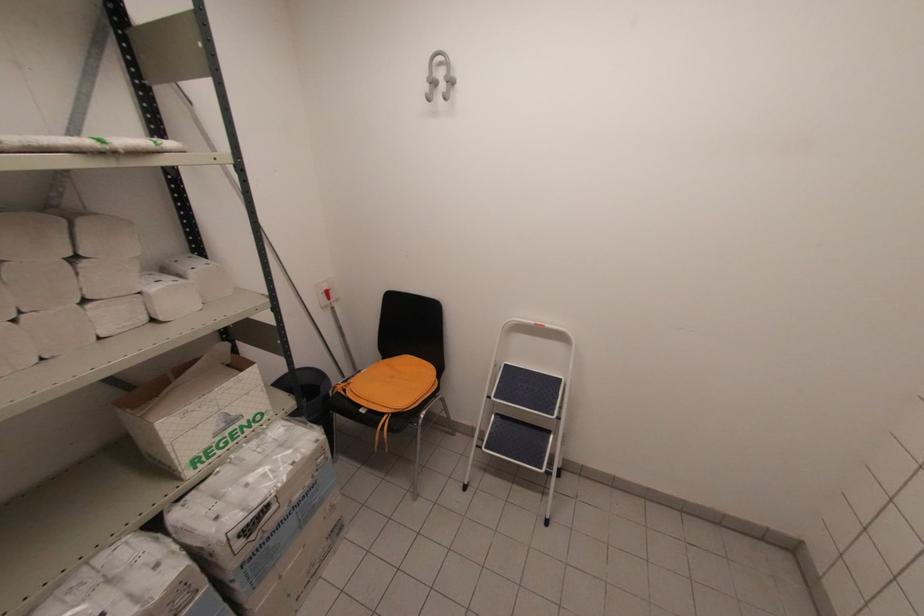
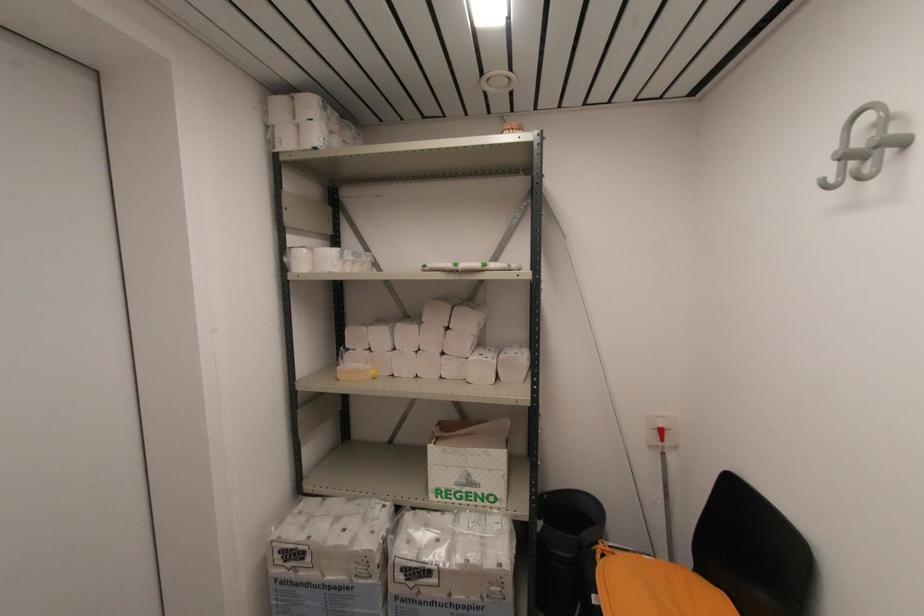
Find the pixel in the second image that matches point (263, 436) in the first image.

(484, 517)